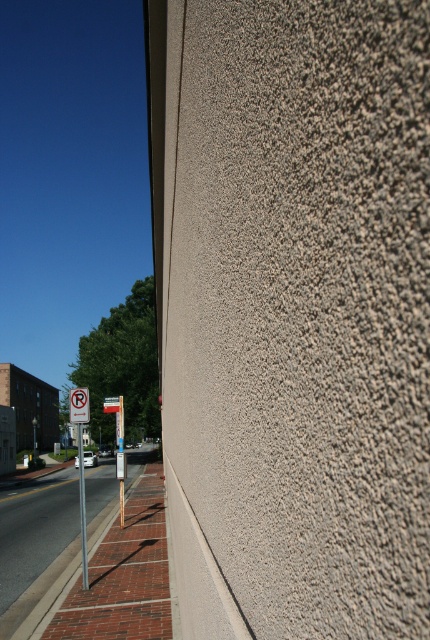
Question: Is brick pavement at lower left to the right of white plastic sign at upper left from the viewer's perspective?

Choices:
 (A) no
 (B) yes

Answer: (A)

Question: Which object is closer to the camera taking this photo?

Choices:
 (A) metallic pole at left
 (B) brick pavement at lower left
 (C) white plastic sign at upper left

Answer: (B)

Question: Which is farther from the metallic pole at left?

Choices:
 (A) brick pavement at lower left
 (B) white plastic sign at upper left

Answer: (B)

Question: Does metallic pole at left come behind white plastic sign at upper left?

Choices:
 (A) no
 (B) yes

Answer: (B)

Question: Is metallic pole at left wider than white plastic sign at upper left?

Choices:
 (A) yes
 (B) no

Answer: (A)

Question: Which of these objects is positioned farthest from the white plastic sign at upper left?

Choices:
 (A) brick pavement at lower left
 (B) metallic pole at left

Answer: (A)